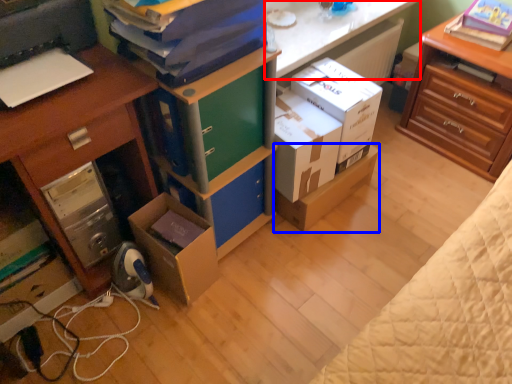
Question: Which point is closer to the camera, counter top (highlighted by a red box) or cardboard box (highlighted by a blue box)?

Choices:
 (A) counter top
 (B) cardboard box

Answer: (A)